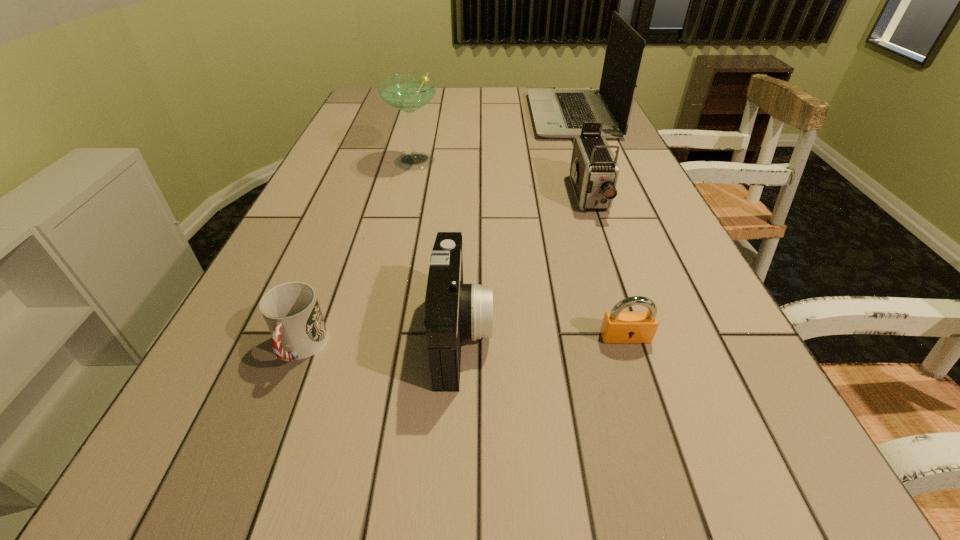
The height and width of the screenshot is (540, 960). I want to click on unoccupied area between the padlock and the farthest object, so click(x=598, y=227).

You are a GUI agent. You are given a task and a screenshot of the screen. Output one action in this format:
    pyautogui.click(x=<x>, y=<y>)
    Task: Click on the free space between the left camcorder and the padlock
    
    Given the screenshot: What is the action you would take?
    pyautogui.click(x=543, y=336)

Identify the location of vacant space in between the laptop computer and the nearer camcorder. The width and height of the screenshot is (960, 540). (516, 225).

Identify the location of vacant space that is in between the leftmost object and the left camcorder. The height and width of the screenshot is (540, 960). (381, 341).

Identify which object is the fifth nearest to the padlock. Please provide its 2D coordinates. Your answer should be formatted as a tuple, i.e. [(x, y)], where the tuple contains the x and y coordinates of a point satisfying the conditions above.

[(558, 113)]

Find the location of a particular element. This screenshot has width=960, height=540. object identified as the third closest to the left camcorder is located at coordinates (594, 171).

What are the coordinates of `vacant point that satisfies the following two spatial constraints: 1. on the screen of the laptop computer; 2. on the side of the leftmost object where the handle is located` in the screenshot? It's located at (661, 348).

Where is `free region that satisfies the following two spatial constraints: 1. on the screen of the tallest object; 2. at the lens of the farther camcorder`? free region that satisfies the following two spatial constraints: 1. on the screen of the tallest object; 2. at the lens of the farther camcorder is located at coordinates (603, 197).

Where is `blank space that satisfies the following two spatial constraints: 1. at the lens of the farther camcorder; 2. on the lens of the nearer camcorder`? The height and width of the screenshot is (540, 960). blank space that satisfies the following two spatial constraints: 1. at the lens of the farther camcorder; 2. on the lens of the nearer camcorder is located at coordinates (636, 334).